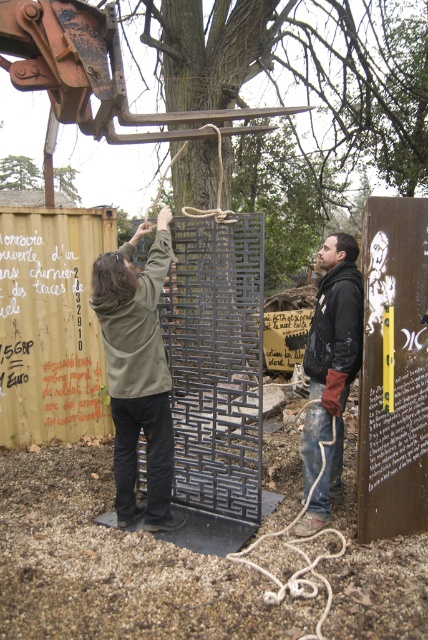
Can you confirm if green matte hoodie at center is positioned above dark brown leather jacket at right?

Correct, green matte hoodie at center is located above dark brown leather jacket at right.

Can you confirm if green matte hoodie at center is taller than dark brown leather jacket at right?

Yes, green matte hoodie at center is taller than dark brown leather jacket at right.

Does point (155, 429) come closer to viewer compared to point (318, 387)?

Yes, point (155, 429) is in front of point (318, 387).

At what (x,y) coordinates should I click in order to perform the action: click on green matte hoodie at center. Please return your answer as a coordinate pair (x, y). The height and width of the screenshot is (640, 428). Looking at the image, I should click on (137, 372).

Consider the image. Between green matte hoodie at center and green leafy tree at upper left, which one is positioned lower?

green matte hoodie at center is lower down.

Which is behind, point (125, 509) or point (29, 186)?

Point (29, 186)

Is point (112, 272) positioned before point (26, 172)?

Yes.

Identify the location of green matte hoodie at center. The height and width of the screenshot is (640, 428). (137, 372).

Between point (353, 246) and point (15, 179), which one is positioned behind?

Point (15, 179)

Is dark brown leather jacket at right below green leafy tree at upper left?

Correct, dark brown leather jacket at right is located below green leafy tree at upper left.

Which is in front, point (332, 314) or point (23, 182)?

Point (332, 314) is more forward.

Find the location of a particular element. This screenshot has width=428, height=640. dark brown leather jacket at right is located at coordinates (329, 372).